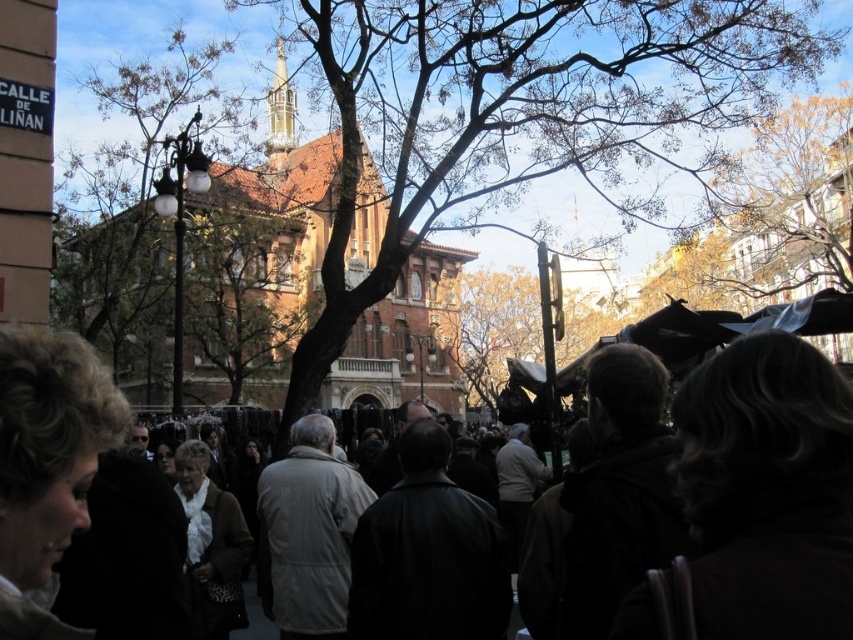
Does brown brick church at center have a greater height compared to beige fabric coat at center?

Indeed, brown brick church at center has a greater height compared to beige fabric coat at center.

Which is below, brown brick church at center or beige fabric coat at center?

beige fabric coat at center is lower down.

This screenshot has width=853, height=640. I want to click on brown brick church at center, so tap(282, 224).

The width and height of the screenshot is (853, 640). In order to click on brown brick church at center in this screenshot , I will do `click(282, 224)`.

Is bare branches at center above brown brick church at center?

No.

The width and height of the screenshot is (853, 640). What do you see at coordinates (575, 106) in the screenshot?
I see `bare branches at center` at bounding box center [575, 106].

Who is more distant from viewer, (647, 152) or (293, 257)?

Positioned behind is point (293, 257).

The height and width of the screenshot is (640, 853). Find the location of `bare branches at center`. bare branches at center is located at coordinates pos(575,106).

Does point (711, 70) come farther from viewer compared to point (315, 438)?

Yes.

Is point (596, 227) positioned in front of point (317, 419)?

No, (596, 227) is behind (317, 419).

Which is in front, point (302, 45) or point (321, 636)?

Positioned in front is point (321, 636).

Identify the location of bare branches at center. (575, 106).